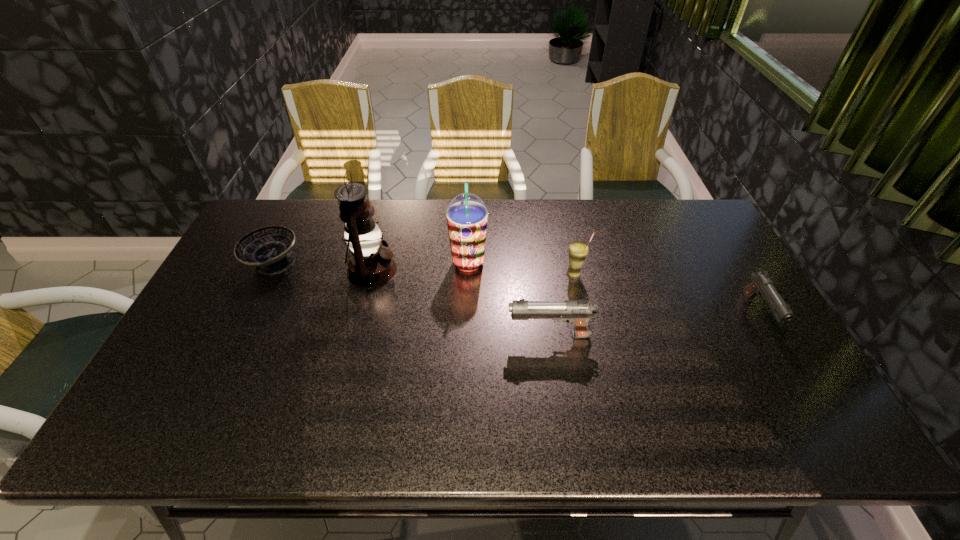
Find the location of a particular element. Image resolution: width=960 pixels, height=540 pixels. free spot between the leftmost object and the shorter gun is located at coordinates (516, 289).

Identify the location of vacant point located between the shorter gun and the shortest object. (516, 289).

The image size is (960, 540). What are the coordinates of `free space between the third shortest object and the second tallest object` in the screenshot? It's located at (509, 299).

This screenshot has width=960, height=540. What are the coordinates of `vacant region between the shorter gun and the third tallest object` in the screenshot? It's located at (666, 294).

You are a GUI agent. You are given a task and a screenshot of the screen. Output one action in this format:
    pyautogui.click(x=<x>, y=<y>)
    Task: Click on the free space between the straw for drinking and the tallest object
    
    Given the screenshot: What is the action you would take?
    pyautogui.click(x=473, y=272)

What are the coordinates of `object that is the nearest to the shortest object` in the screenshot? It's located at (369, 265).

Locate an element on the screen. The image size is (960, 540). object that is the second nearest to the straw for drinking is located at coordinates (467, 215).